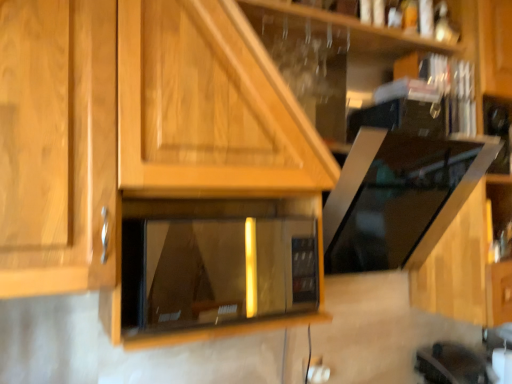
Question: Can we say white plastic electric outlet at lower center lies outside wooden at upper center?

Choices:
 (A) no
 (B) yes

Answer: (B)

Question: Is the position of white plastic electric outlet at lower center more distant than that of wooden at upper center?

Choices:
 (A) no
 (B) yes

Answer: (B)

Question: Can you confirm if white plastic electric outlet at lower center is positioned to the left of wooden at upper center?

Choices:
 (A) no
 (B) yes

Answer: (B)

Question: From a real-world perspective, is white plastic electric outlet at lower center beneath wooden at upper center?

Choices:
 (A) no
 (B) yes

Answer: (B)

Question: Is white plastic electric outlet at lower center smaller than wooden at upper center?

Choices:
 (A) no
 (B) yes

Answer: (B)

Question: From a real-world perspective, is white plastic electric outlet at lower center positioned above or below matte black microwave at center?

Choices:
 (A) above
 (B) below

Answer: (B)

Question: From the image's perspective, is white plastic electric outlet at lower center above or below matte black microwave at center?

Choices:
 (A) below
 (B) above

Answer: (A)

Question: In terms of width, does white plastic electric outlet at lower center look wider or thinner when compared to matte black microwave at center?

Choices:
 (A) thin
 (B) wide

Answer: (A)

Question: Based on their sizes in the image, would you say white plastic electric outlet at lower center is bigger or smaller than matte black microwave at center?

Choices:
 (A) small
 (B) big

Answer: (A)

Question: From a real-world perspective, is wooden at upper center positioned above or below white plastic electric outlet at lower center?

Choices:
 (A) above
 (B) below

Answer: (A)

Question: Do you think wooden at upper center is within white plastic electric outlet at lower center, or outside of it?

Choices:
 (A) inside
 (B) outside

Answer: (B)

Question: From their relative heights in the image, would you say wooden at upper center is taller or shorter than white plastic electric outlet at lower center?

Choices:
 (A) short
 (B) tall

Answer: (B)

Question: From the image's perspective, is wooden at upper center above or below white plastic electric outlet at lower center?

Choices:
 (A) below
 (B) above

Answer: (B)

Question: Is wooden at upper center in front of or behind matte black microwave at center in the image?

Choices:
 (A) behind
 (B) front

Answer: (A)

Question: From the image's perspective, relative to matte black microwave at center, is wooden at upper center above or below?

Choices:
 (A) below
 (B) above

Answer: (B)